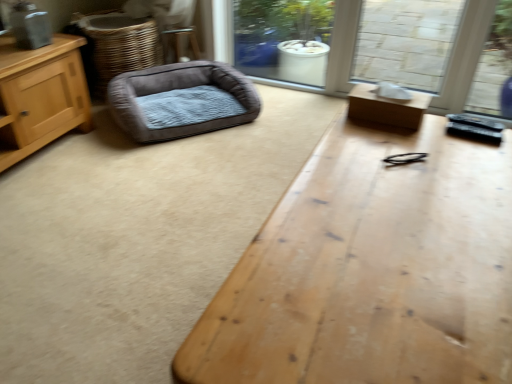
Locate an element on the screen. Image resolution: width=512 pixels, height=384 pixels. spots to the right of velvet-like brown dog bed at left is located at coordinates (287, 120).